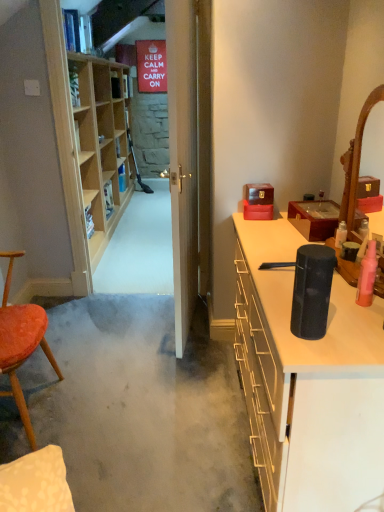
Locate an element on the screen. The image size is (384, 512). vacant region under velvet orange chair at left (from a real-world perspective) is located at coordinates (29, 410).